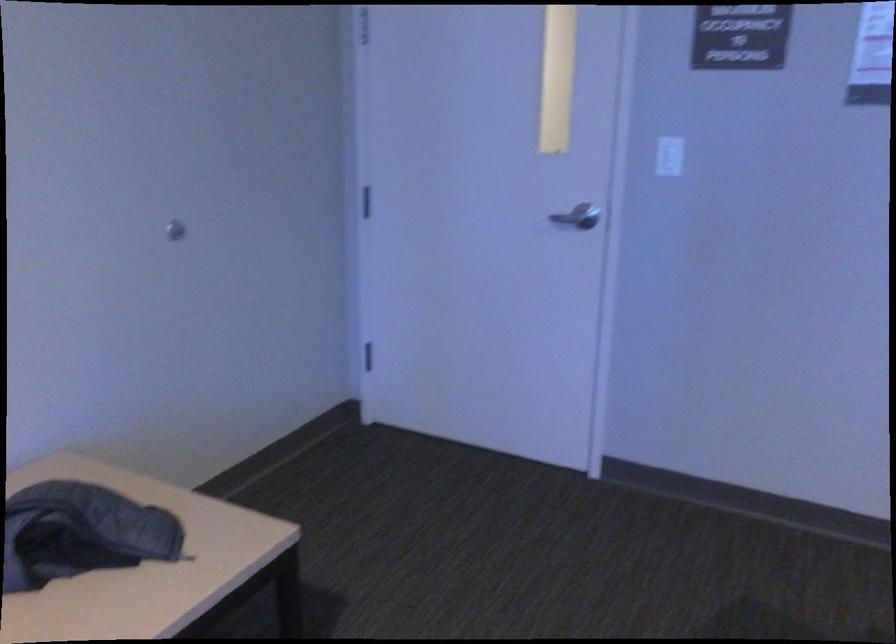
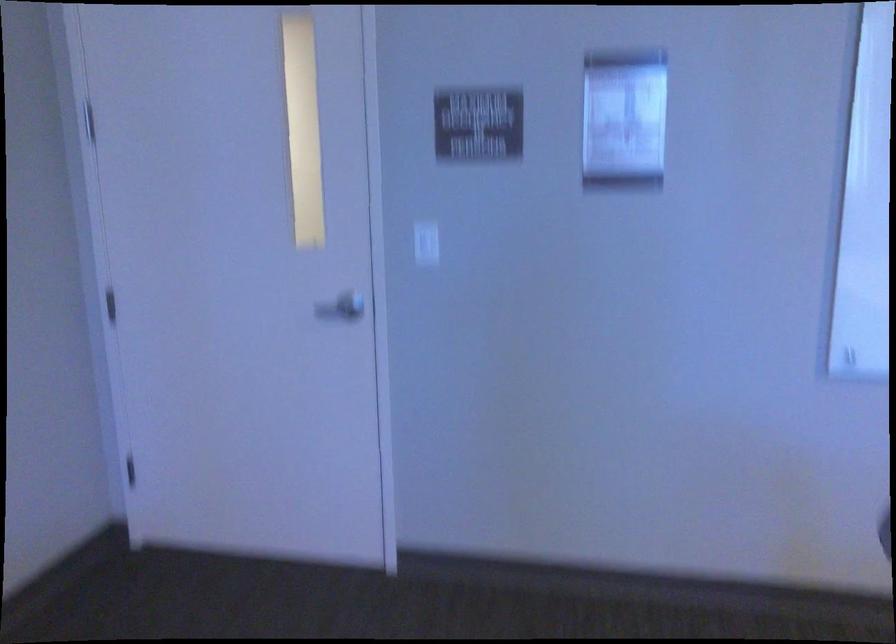
In the scene shown: In a continuous first-person perspective shot, in which direction is the camera moving?

The cameraman moved toward right, forward.